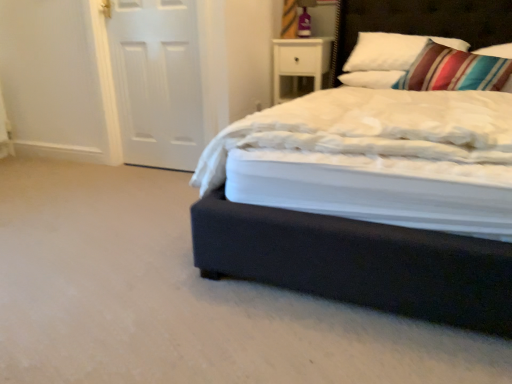
Question: From a real-world perspective, does white soft pillow at upper right, the first pillow positioned from the left, stand above dark wood headboard at upper right?

Choices:
 (A) no
 (B) yes

Answer: (A)

Question: Is white soft pillow at upper right, marked as the second pillow in a right-to-left arrangement, to the left of dark wood headboard at upper right from the viewer's perspective?

Choices:
 (A) yes
 (B) no

Answer: (A)

Question: Considering the relative sizes of white soft pillow at upper right, the first pillow positioned from the left, and dark wood headboard at upper right in the image provided, is white soft pillow at upper right, the first pillow positioned from the left, taller than dark wood headboard at upper right?

Choices:
 (A) no
 (B) yes

Answer: (A)

Question: Can you confirm if white soft pillow at upper right, marked as the second pillow in a right-to-left arrangement, is smaller than dark wood headboard at upper right?

Choices:
 (A) no
 (B) yes

Answer: (B)

Question: Is dark wood headboard at upper right located within white soft pillow at upper right, the first pillow positioned from the left?

Choices:
 (A) no
 (B) yes

Answer: (A)

Question: In terms of height, does white soft pillow at upper right, marked as the second pillow in a right-to-left arrangement, look taller or shorter compared to dark wood headboard at upper right?

Choices:
 (A) tall
 (B) short

Answer: (B)

Question: From the image's perspective, is white soft pillow at upper right, marked as the second pillow in a right-to-left arrangement, located above or below dark wood headboard at upper right?

Choices:
 (A) above
 (B) below

Answer: (B)

Question: From a real-world perspective, is white soft pillow at upper right, the first pillow positioned from the left, physically located above or below dark wood headboard at upper right?

Choices:
 (A) below
 (B) above

Answer: (A)

Question: Is point (348, 76) closer or farther from the camera than point (425, 18)?

Choices:
 (A) farther
 (B) closer

Answer: (B)

Question: In terms of width, does striped fabric pillow at upper right, which appears as the 1th pillow when viewed from the right, look wider or thinner when compared to white matte door at left?

Choices:
 (A) wide
 (B) thin

Answer: (A)

Question: In terms of height, does striped fabric pillow at upper right, which ranks as the second pillow in left-to-right order, look taller or shorter compared to white matte door at left?

Choices:
 (A) tall
 (B) short

Answer: (B)

Question: Is striped fabric pillow at upper right, which appears as the 1th pillow when viewed from the right, inside the boundaries of white matte door at left, or outside?

Choices:
 (A) outside
 (B) inside

Answer: (A)

Question: Based on their positions, is striped fabric pillow at upper right, which appears as the 1th pillow when viewed from the right, located to the left or right of white matte door at left?

Choices:
 (A) right
 (B) left

Answer: (A)

Question: Would you say white glossy nightstand at upper right is inside or outside dark wood headboard at upper right?

Choices:
 (A) outside
 (B) inside

Answer: (A)

Question: Relative to dark wood headboard at upper right, is white glossy nightstand at upper right in front or behind?

Choices:
 (A) front
 (B) behind

Answer: (B)